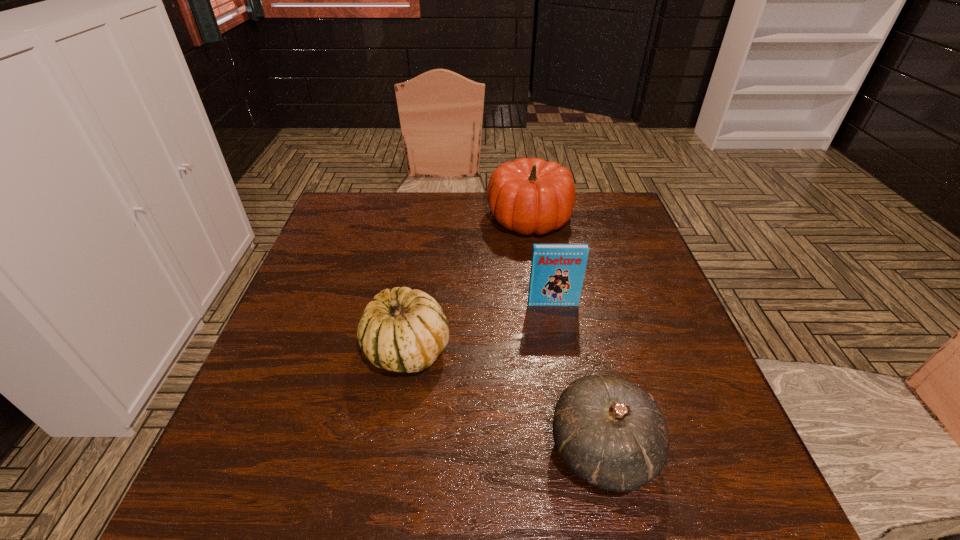
Identify the location of pumpkin. The width and height of the screenshot is (960, 540). (528, 196).

This screenshot has width=960, height=540. In order to click on book in this screenshot , I will do `click(557, 272)`.

What are the coordinates of `the farther gourd` in the screenshot? It's located at [x=402, y=330].

This screenshot has height=540, width=960. Find the location of `the leftmost object`. the leftmost object is located at coordinates (402, 330).

Identify the location of the nearest object. (611, 433).

Locate an element on the screen. the nearer gourd is located at coordinates (611, 433).

Image resolution: width=960 pixels, height=540 pixels. What are the coordinates of `vacant point located on the front of the farthest object` in the screenshot? It's located at (548, 342).

The height and width of the screenshot is (540, 960). What are the coordinates of `vacant space located on the front cover of the second farthest object` in the screenshot? It's located at (567, 388).

This screenshot has height=540, width=960. I want to click on vacant space located on the back of the farther gourd, so click(x=420, y=269).

You are a GUI agent. You are given a task and a screenshot of the screen. Output one action in this format:
    pyautogui.click(x=<x>, y=<y>)
    Task: Click on the vacant space located on the left of the right gourd
    This screenshot has height=540, width=960.
    Given the screenshot: What is the action you would take?
    pyautogui.click(x=453, y=449)